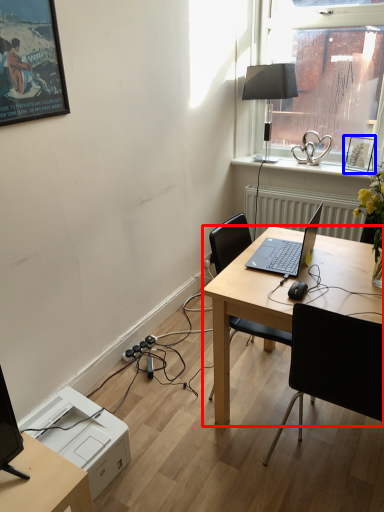
Question: Which object is closer to the camera taking this photo, desk (highlighted by a red box) or picture frame (highlighted by a blue box)?

Choices:
 (A) desk
 (B) picture frame

Answer: (A)